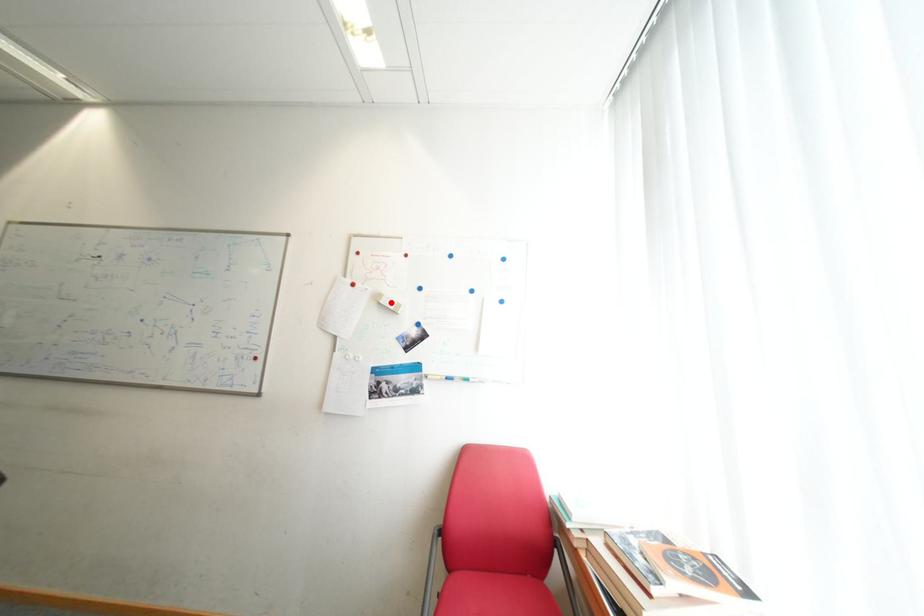
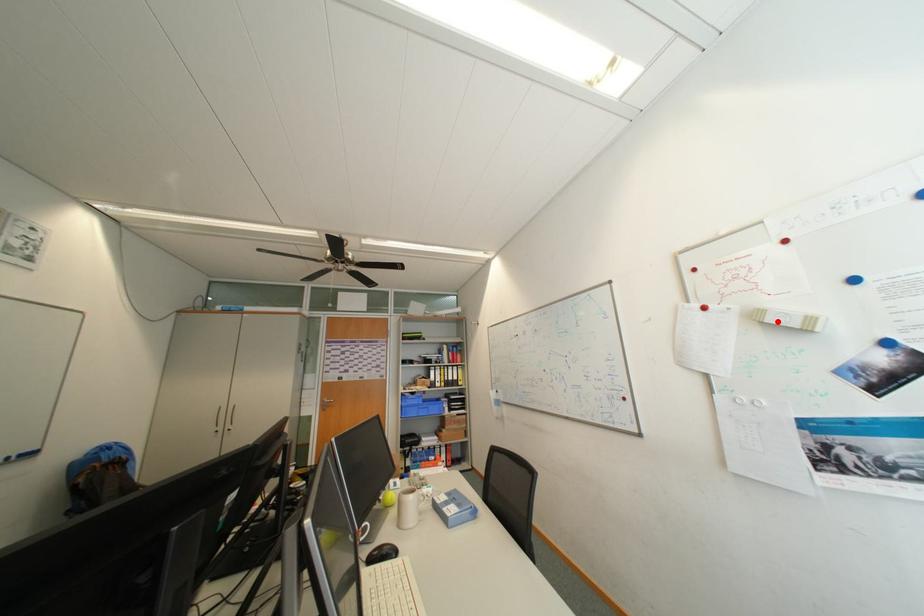
I am providing you with two images of the same scene from different viewpoints. A red point is marked on the first image and another point is marked on the second image. Is the red point in image1 aligned with the point shown in image2?

Yes